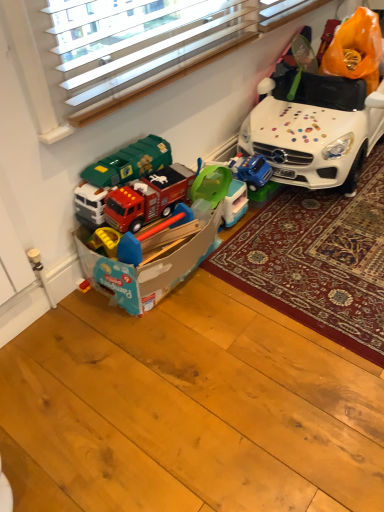
Question: Is green plastic toy at center, acting as the second toy starting from the front, to the left or to the right of white glossy toy car at upper right in the image?

Choices:
 (A) left
 (B) right

Answer: (A)

Question: In terms of height, does green plastic toy at center, arranged as the 1th toy when viewed from the back, look taller or shorter compared to white glossy toy car at upper right?

Choices:
 (A) short
 (B) tall

Answer: (A)

Question: Estimate the real-world distances between objects in this image. Which object is farther from the white glossy toy car at upper right?

Choices:
 (A) white carpet at center
 (B) green plastic toy at center, acting as the second toy starting from the front
 (C) matte plastic toy box at lower left, placed as the second toy when sorted from back to front

Answer: (C)

Question: Which of these objects is positioned farthest from the white glossy toy car at upper right?

Choices:
 (A) green plastic toy at center, acting as the second toy starting from the front
 (B) white carpet at center
 (C) matte plastic toy box at lower left, marked as the 1th toy in a front-to-back arrangement

Answer: (C)